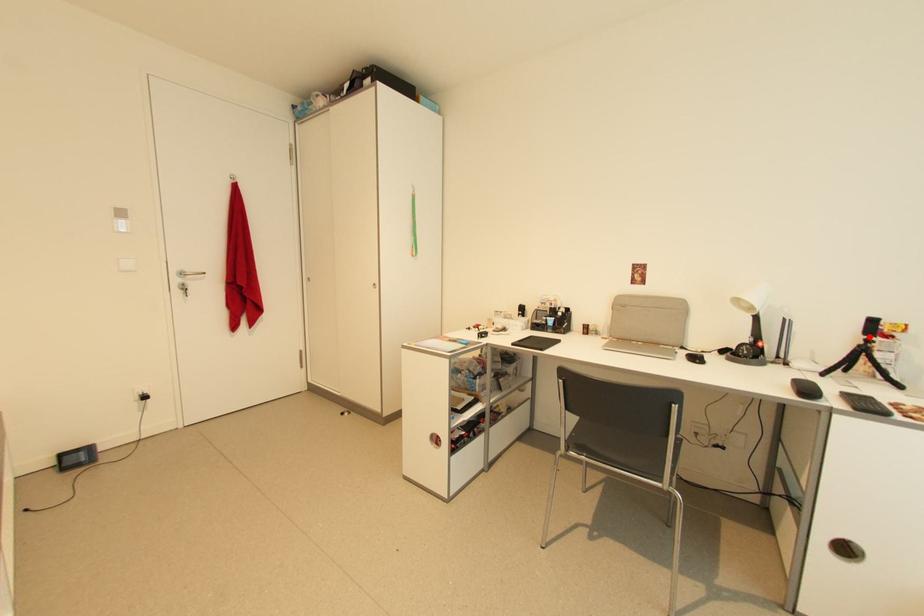
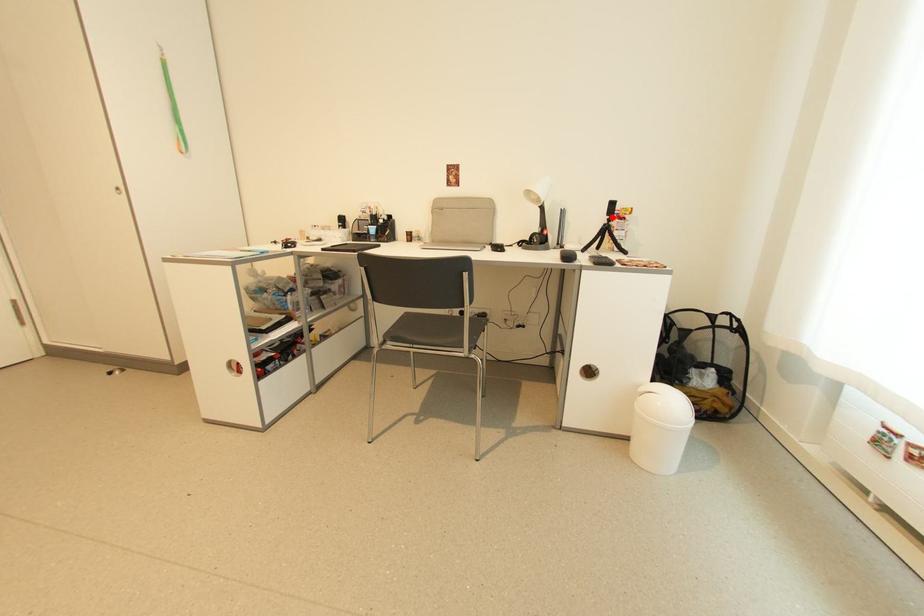
I am providing you with two images of the same scene from different viewpoints. A red point is marked on the first image and another point is marked on the second image. Do the highlighted points in image1 and image2 indicate the same real-world spot?

Yes